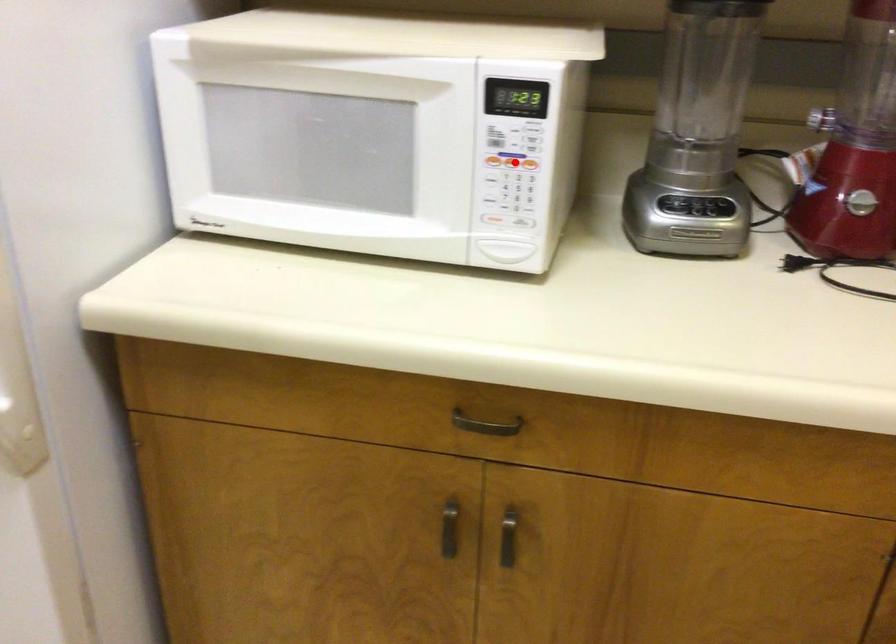
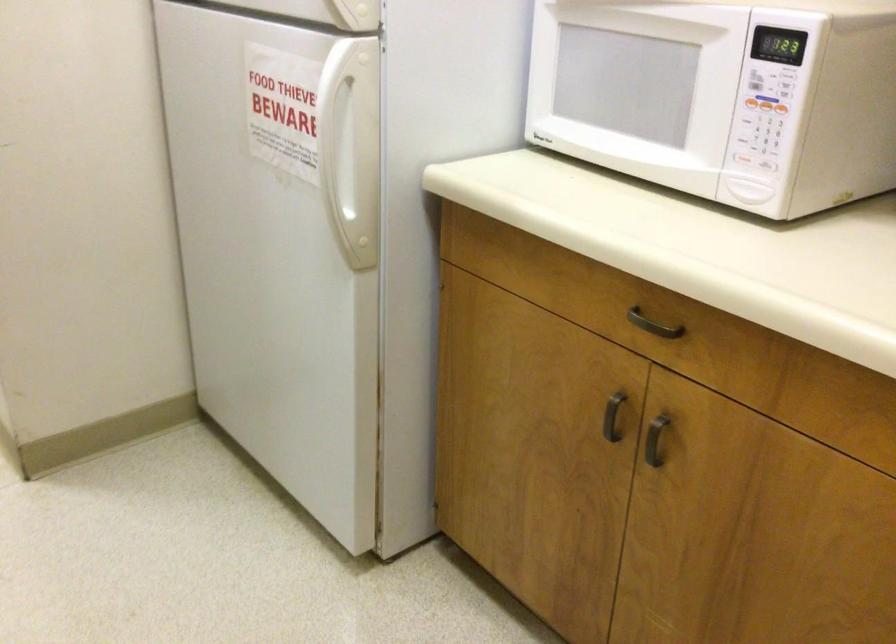
In the second image, find the point that corresponds to the highlighted location in the first image.

(765, 104)